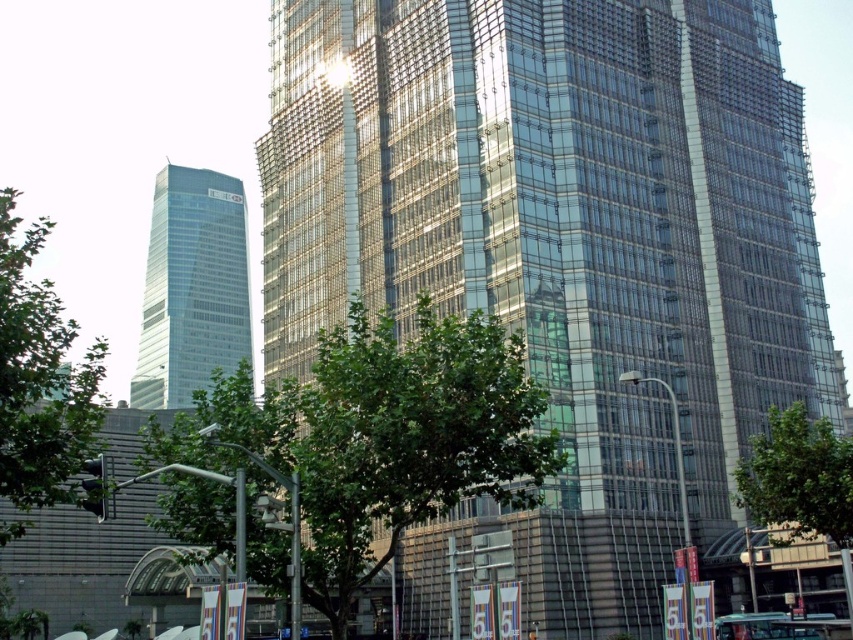
Question: Which object is farther from the camera taking this photo?

Choices:
 (A) metallic silver car at center
 (B) green leafy tree at center
 (C) green leafy tree at lower right
 (D) green leafy tree at left

Answer: (A)

Question: Where is clear glass skyscraper at left located in relation to green leafy tree at lower right in the image?

Choices:
 (A) right
 (B) left

Answer: (B)

Question: Among these objects, which one is farthest from the camera?

Choices:
 (A) green leafy tree at left
 (B) clear glass skyscraper at left
 (C) green leafy tree at lower right
 (D) green leafy tree at center

Answer: (B)

Question: Does transparent glass building at center have a lesser width compared to green leafy tree at center?

Choices:
 (A) yes
 (B) no

Answer: (B)

Question: Is transparent glass building at center in front of metallic silver car at center?

Choices:
 (A) yes
 (B) no

Answer: (B)

Question: Among these objects, which one is farthest from the camera?

Choices:
 (A) green leafy tree at lower right
 (B) metallic silver car at center

Answer: (B)